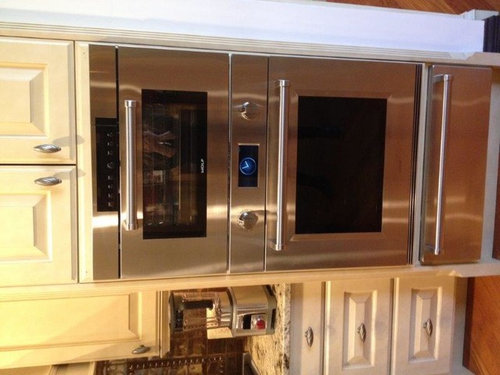
You are a GUI agent. You are given a task and a screenshot of the screen. Output one action in this format:
    pyautogui.click(x=<x>, y=<y>)
    Task: Click on the drawer
    The width and height of the screenshot is (500, 375).
    Given the screenshot: What is the action you would take?
    pyautogui.click(x=309, y=353), pyautogui.click(x=353, y=351), pyautogui.click(x=421, y=357)